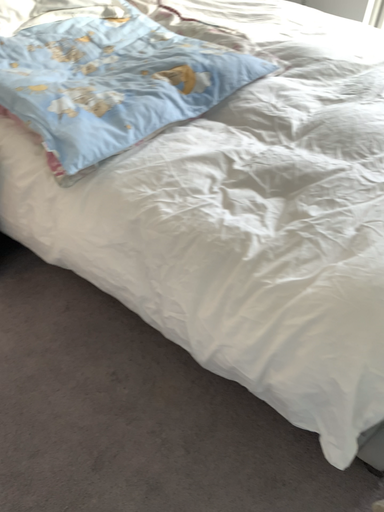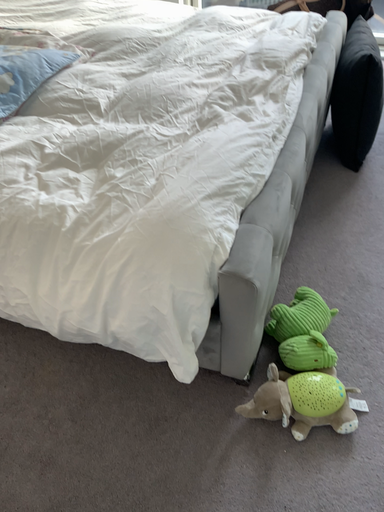
Question: Which way did the camera rotate in the video?

Choices:
 (A) rotated left
 (B) rotated right

Answer: (B)